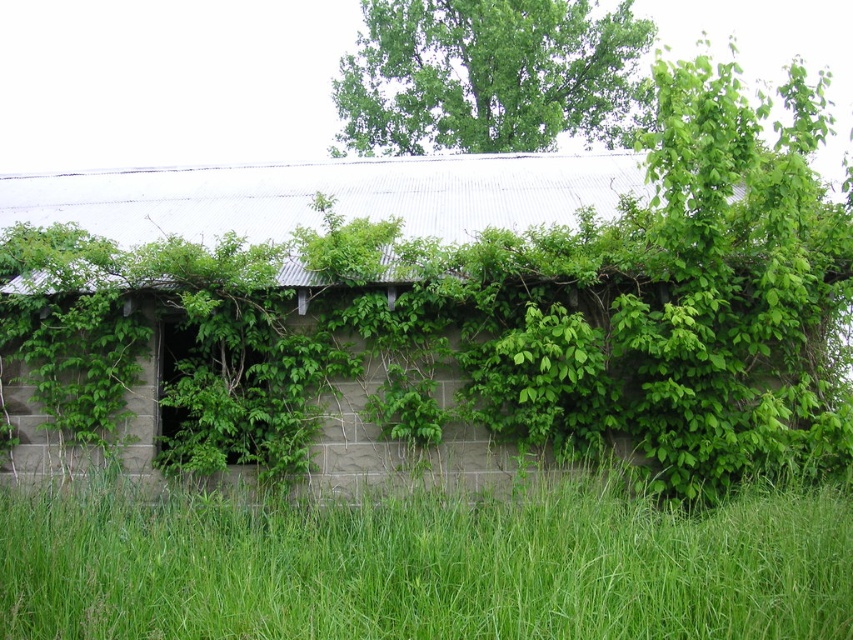
You are standing in front of an old barn and notice green grass at lower center and a green leafy tree at upper center. Which object is nearer to you?

The green grass at lower center is closer to the viewer than the green leafy tree at upper center.

Consider the image. You are a gardener who wants to mow the green grass at lower center and trim the green leafy tree at upper center. Which object requires more effort due to its size?

The green leafy tree at upper center requires more effort because it is larger than the green grass at lower center.

You are standing in front of an old barn with green grass at lower center and a green leafy tree at upper center. Which object is taller?

The green leafy tree at upper center is taller than the green grass at lower center.